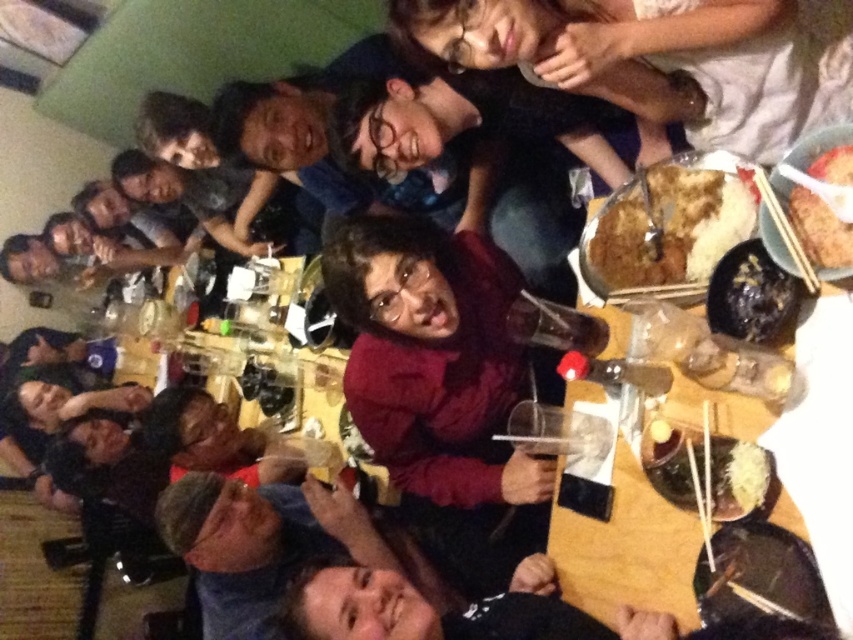
Question: Which of the following is the farthest from the observer?

Choices:
 (A) wooden table at center
 (B) brown crispy rice at center
 (C) dark red sweater at center
 (D) black glossy bowl at lower right

Answer: (C)

Question: Can you confirm if dark red sweater at center is positioned to the left of brown crispy rice at center?

Choices:
 (A) no
 (B) yes

Answer: (B)

Question: Is black glossy bowl at lower right bigger than brown rice at upper right?

Choices:
 (A) yes
 (B) no

Answer: (A)

Question: Estimate the real-world distances between objects in this image. Which object is farther from the dark red sweater at center?

Choices:
 (A) brown crispy rice at center
 (B) black glossy bowl at lower right
 (C) wooden table at center

Answer: (B)

Question: Does dark red sweater at center have a lesser width compared to brown crispy rice at center?

Choices:
 (A) yes
 (B) no

Answer: (B)

Question: Which object is closer to the camera taking this photo?

Choices:
 (A) wooden table at center
 (B) dark red sweater at center
 (C) black glossy bowl at lower right
 (D) brown crispy rice at center

Answer: (A)